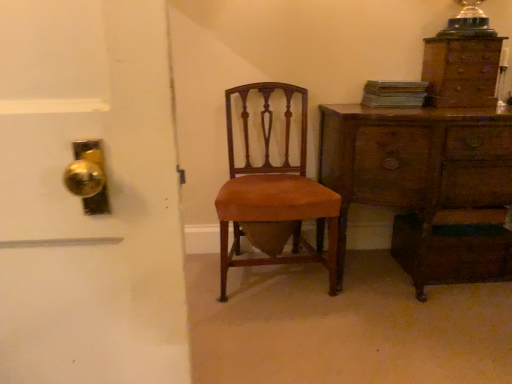
Find the location of a particular element. free point below wooden chest of drawers at right, the first chest of drawers positioned from the bottom (from a real-world perspective) is located at coordinates (406, 278).